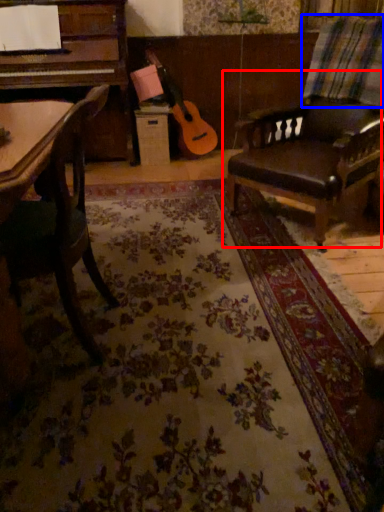
Question: Which object appears closest to the camera in this image, chair (highlighted by a red box) or plaid (highlighted by a blue box)?

Choices:
 (A) chair
 (B) plaid

Answer: (A)